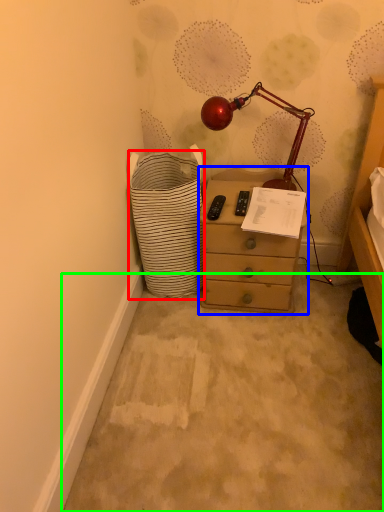
Question: Which is farther away from shopping basket (highlighted by a red box)? chest of drawers (highlighted by a blue box) or concrete (highlighted by a green box)?

Choices:
 (A) chest of drawers
 (B) concrete

Answer: (B)